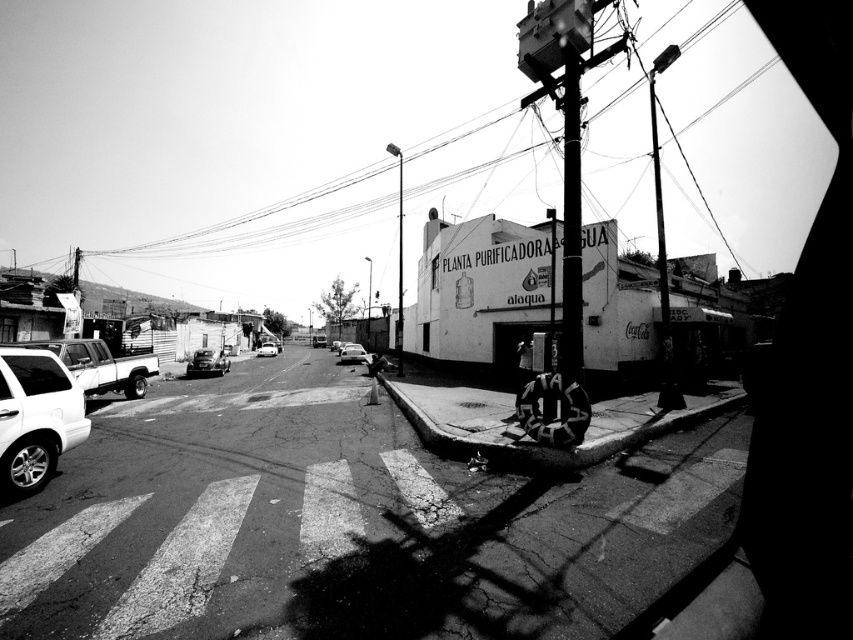
Question: Is white matte truck at center-left bigger than shiny black car at center?

Choices:
 (A) yes
 (B) no

Answer: (A)

Question: Can you confirm if white glossy suv at lower left is positioned to the right of shiny silver car at center?

Choices:
 (A) no
 (B) yes

Answer: (B)

Question: Which point is farther from the camera taking this photo?

Choices:
 (A) (190, 358)
 (B) (358, 349)
 (C) (271, 344)
 (D) (82, 385)

Answer: (C)

Question: Is white glossy suv at lower left positioned at the back of shiny black car at center?

Choices:
 (A) yes
 (B) no

Answer: (B)

Question: Which of the following is the farthest from the observer?

Choices:
 (A) shiny silver car at center
 (B) white matte truck at center-left
 (C) smooth concrete curb at lower center

Answer: (A)

Question: Which is nearer to the silver metallic sedan at center?

Choices:
 (A) shiny black car at center
 (B) shiny silver car at center
 (C) smooth concrete curb at lower center

Answer: (A)